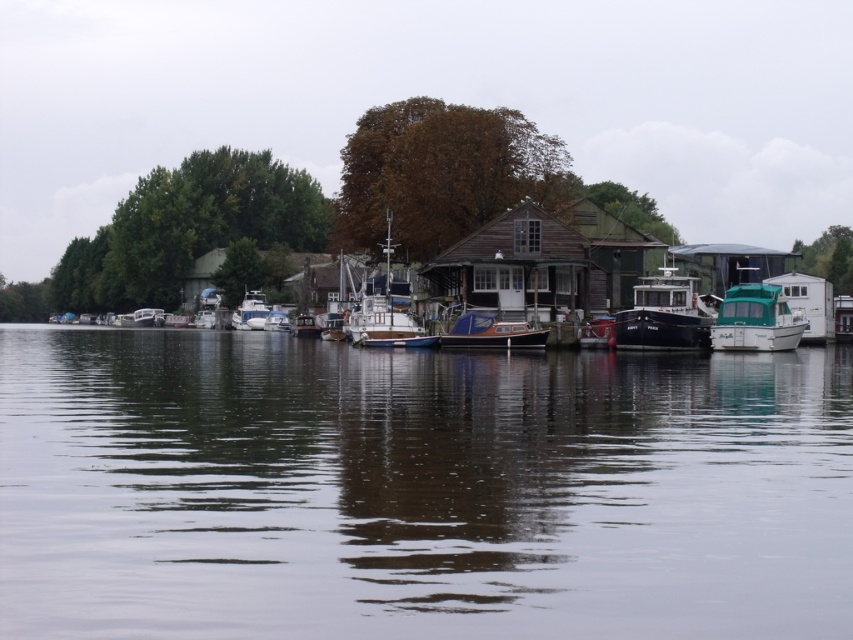
You are planning to store a tall sculpture that is 2 meters in height. You have access to the matte black boat at center and the teal glossy houseboat at right. Based on their heights, which boat would be more suitable for storing the sculpture?

The matte black boat at center has a greater height compared to the teal glossy houseboat at right, so it would be more suitable for storing the tall sculpture since it provides more vertical space.